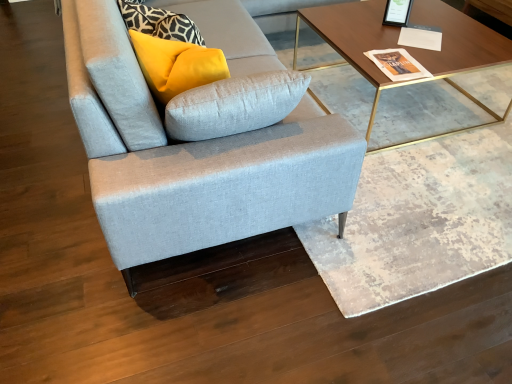
Question: Does point (219, 64) appear closer or farther from the camera than point (322, 6)?

Choices:
 (A) farther
 (B) closer

Answer: (B)

Question: Is matte yellow pillow at upper left to the left or to the right of wooden/golden metal legs coffee table at upper right in the image?

Choices:
 (A) right
 (B) left

Answer: (B)

Question: Which of these objects is positioned closest to the matte yellow pillow at upper left?

Choices:
 (A) wooden/golden metal legs coffee table at upper right
 (B) light gray fabric couch at center

Answer: (B)

Question: Based on their relative distances, which object is nearer to the wooden/golden metal legs coffee table at upper right?

Choices:
 (A) light gray fabric couch at center
 (B) matte yellow pillow at upper left

Answer: (A)